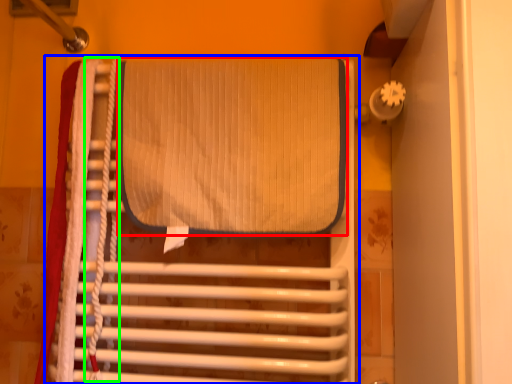
Question: Based on their relative distances, which object is nearer to wide (highlighted by a red box)? Choose from furniture (highlighted by a blue box) and rope (highlighted by a green box).

Choices:
 (A) furniture
 (B) rope

Answer: (A)